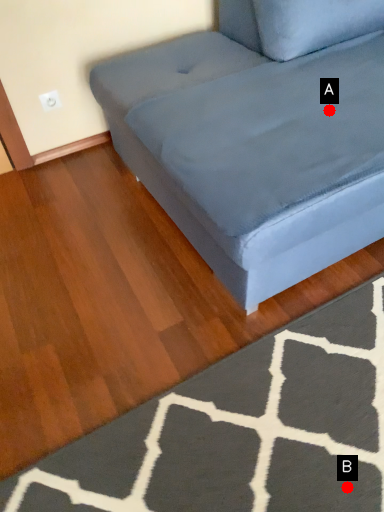
Question: Two points are circled on the image, labeled by A and B beside each circle. Which point is closer to the camera taking this photo?

Choices:
 (A) A is closer
 (B) B is closer

Answer: (B)